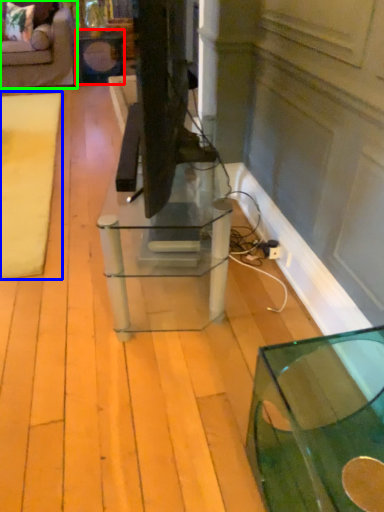
Question: Estimate the real-world distances between objects in this image. Which object is closer to side table (highlighted by a red box), mat (highlighted by a blue box) or furniture (highlighted by a green box)?

Choices:
 (A) mat
 (B) furniture

Answer: (B)